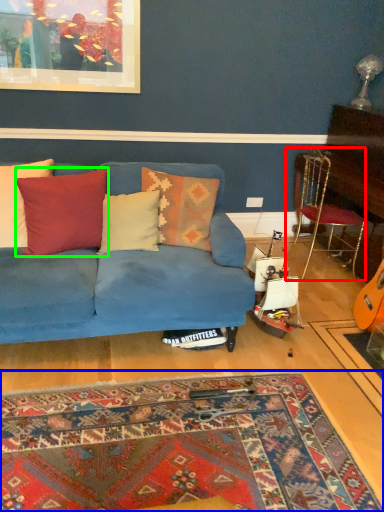
Question: Based on their relative distances, which object is nearer to chair (highlighted by a red box)? Choose from mat (highlighted by a blue box) and pillow (highlighted by a green box).

Choices:
 (A) mat
 (B) pillow

Answer: (B)